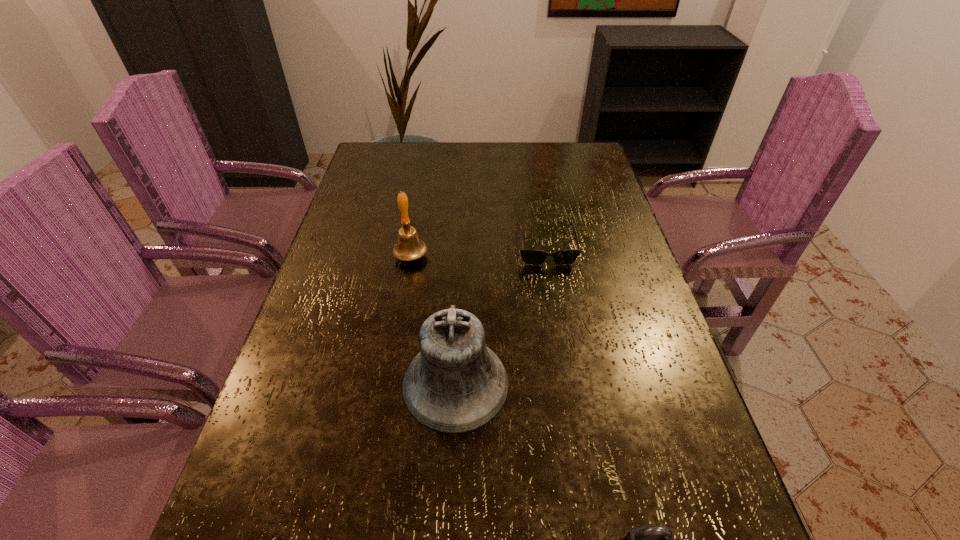
Locate an element on the screen. Image resolution: width=960 pixels, height=540 pixels. the nearer bell is located at coordinates (455, 384).

I want to click on the farther bell, so click(409, 247).

Where is `the shortest object`? This screenshot has width=960, height=540. the shortest object is located at coordinates pyautogui.click(x=533, y=257).

The height and width of the screenshot is (540, 960). I want to click on vacant space positioned 0.320m on the back of the second nearest object, so click(462, 248).

Where is `free space located on the back of the farther bell`? Image resolution: width=960 pixels, height=540 pixels. free space located on the back of the farther bell is located at coordinates (424, 174).

Locate an element on the screen. The width and height of the screenshot is (960, 540). vacant space located at the front lenses of the shortest object is located at coordinates (562, 342).

Image resolution: width=960 pixels, height=540 pixels. Identify the location of object at the right edge. (533, 257).

In the image, there is a desktop. At what (x,y) coordinates should I click in order to perform the action: click on vacant space at the far edge. Please return your answer as a coordinate pair (x, y). Image resolution: width=960 pixels, height=540 pixels. Looking at the image, I should click on 491,162.

You are a GUI agent. You are given a task and a screenshot of the screen. Output one action in this format:
    pyautogui.click(x=<x>, y=<y>)
    Task: Click on the free space at the left edge of the desktop
    
    Given the screenshot: What is the action you would take?
    pyautogui.click(x=387, y=256)

Find the location of a particular element. The width and height of the screenshot is (960, 540). vacant space at the right edge of the desktop is located at coordinates (617, 234).